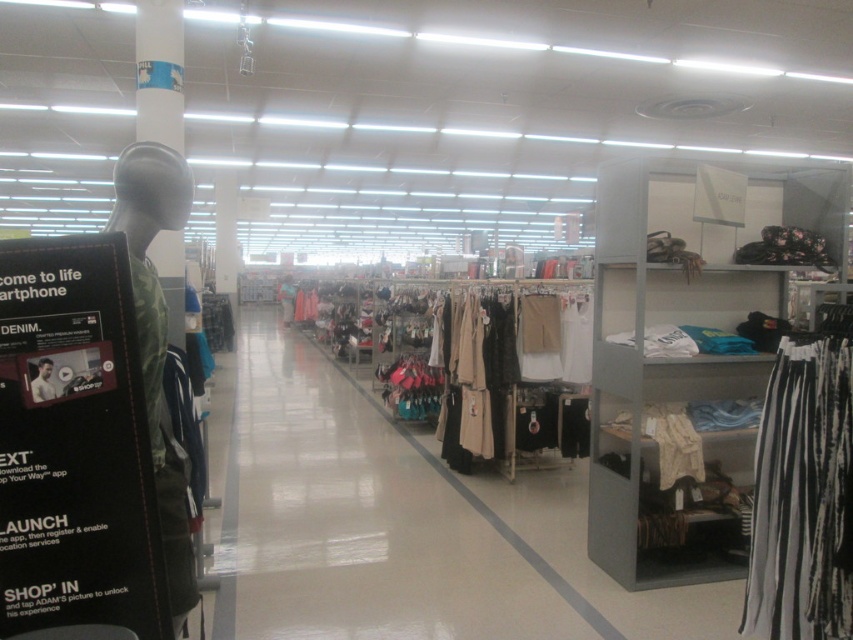
Consider the image. Is white fabric clothing at center to the right of matte beige dress at center from the viewer's perspective?

Incorrect, white fabric clothing at center is not on the right side of matte beige dress at center.

Which is more to the right, white fabric clothing at center or matte beige dress at center?

matte beige dress at center

Between point (293, 540) and point (543, 401), which one is positioned in front?

Positioned in front is point (293, 540).

Identify the location of white fabric clothing at center. (370, 520).

Is metallic gray shelf at right wider than matte beige dress at center?

In fact, metallic gray shelf at right might be narrower than matte beige dress at center.

Consider the image. Can you confirm if metallic gray shelf at right is shorter than matte beige dress at center?

In fact, metallic gray shelf at right may be taller than matte beige dress at center.

Between point (715, 552) and point (572, 284), which one is positioned in front?

Point (715, 552) is more forward.

Identify the location of metallic gray shelf at right. Image resolution: width=853 pixels, height=640 pixels. (691, 352).

Does metallic gray shelf at right have a greater width compared to white cotton shirt at center?

Correct, the width of metallic gray shelf at right exceeds that of white cotton shirt at center.

Between point (666, 426) and point (44, 381), which one is positioned behind?

Point (666, 426)

Does point (660, 464) lie behind point (32, 394)?

That is True.

The width and height of the screenshot is (853, 640). In order to click on metallic gray shelf at right in this screenshot , I will do `click(691, 352)`.